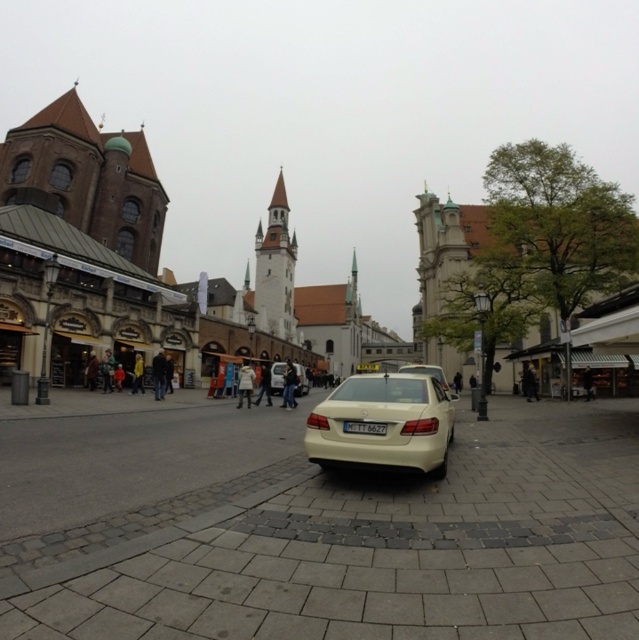
Is point (158, 182) farther from viewer compared to point (132, 381)?

Yes.

Is white glossy car at center shorter than light brown leather jacket at center?

Incorrect, white glossy car at center's height does not fall short of light brown leather jacket at center's.

You are a GUI agent. You are given a task and a screenshot of the screen. Output one action in this format:
    pyautogui.click(x=<x>, y=<y>)
    Task: Click on the white glossy car at center
    This screenshot has width=639, height=640.
    Given the screenshot: What is the action you would take?
    pyautogui.click(x=139, y=262)

Locate an element on the screen. This screenshot has height=640, width=639. white glossy car at center is located at coordinates (139, 262).

In the scene shown: Is matte beige sedan at center positioned before dark blue jeans at center?

Yes, matte beige sedan at center is closer to the viewer.

Is matte beige sedan at center shorter than dark blue jeans at center?

No, matte beige sedan at center is not shorter than dark blue jeans at center.

Measure the distance between point (440, 428) and camera.

The distance of point (440, 428) from camera is 129.20 feet.

This screenshot has width=639, height=640. What are the coordinates of `matte beige sedan at center` in the screenshot? It's located at (383, 422).

Between white glossy car at center and dark blue jeans at center, which one has less height?

With less height is dark blue jeans at center.

Who is more forward, (43, 132) or (164, 368)?

Positioned in front is point (164, 368).

The width and height of the screenshot is (639, 640). In order to click on white glossy car at center in this screenshot , I will do pos(139,262).